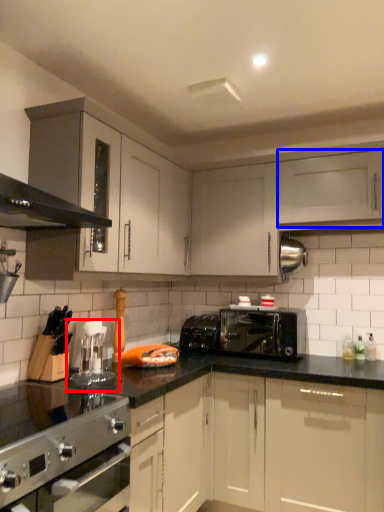
Question: Which object is further to the camera taking this photo, coffee machine (highlighted by a red box) or cabinetry (highlighted by a blue box)?

Choices:
 (A) coffee machine
 (B) cabinetry

Answer: (B)